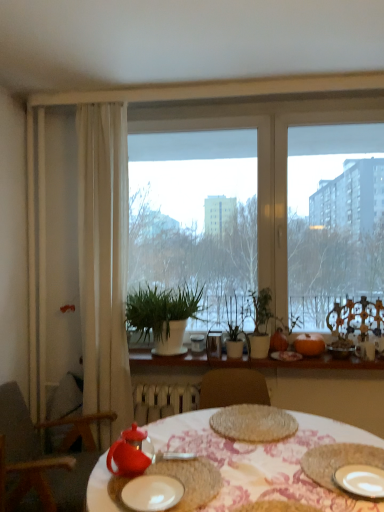
Image resolution: width=384 pixels, height=512 pixels. Find the location of `vacant space to the right of matte red teapot at lower center, placed as the 1th tableware when sorted from left to right`. vacant space to the right of matte red teapot at lower center, placed as the 1th tableware when sorted from left to right is located at coordinates (191, 470).